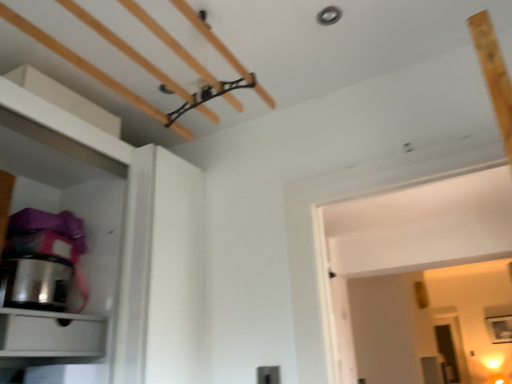
Question: Is stainless steel pot at left inside or outside of matte white drawer at lower left?

Choices:
 (A) inside
 (B) outside

Answer: (B)

Question: Visually, is stainless steel pot at left positioned to the left or to the right of matte white drawer at lower left?

Choices:
 (A) right
 (B) left

Answer: (B)

Question: From the image's perspective, is stainless steel pot at left located above or below matte white drawer at lower left?

Choices:
 (A) above
 (B) below

Answer: (A)

Question: From a real-world perspective, is matte white drawer at lower left positioned above or below stainless steel pot at left?

Choices:
 (A) above
 (B) below

Answer: (B)

Question: Is matte white drawer at lower left taller or shorter than stainless steel pot at left?

Choices:
 (A) short
 (B) tall

Answer: (A)

Question: From the image's perspective, is matte white drawer at lower left located above or below stainless steel pot at left?

Choices:
 (A) below
 (B) above

Answer: (A)

Question: Based on their positions, is matte white drawer at lower left located to the left or right of stainless steel pot at left?

Choices:
 (A) left
 (B) right

Answer: (B)